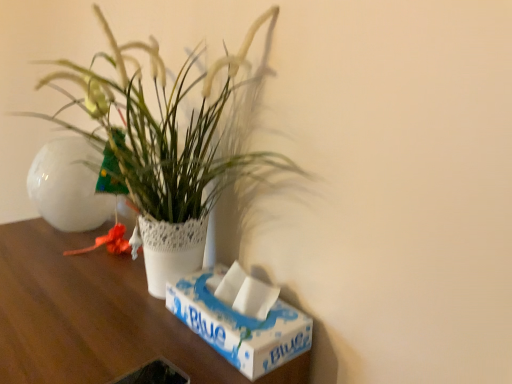
Where is `vacant space to the left of white cardboard box at lower right`? The image size is (512, 384). vacant space to the left of white cardboard box at lower right is located at coordinates (120, 327).